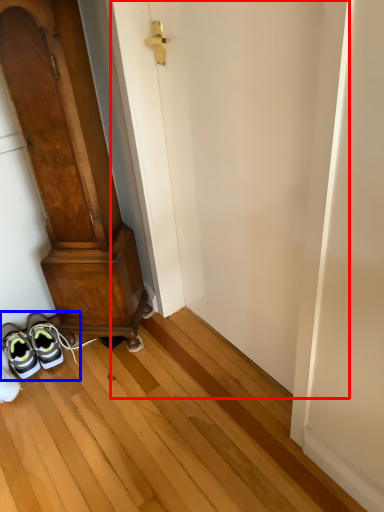
Question: Which of the following is the farthest to the observer, door (highlighted by a red box) or footwear (highlighted by a blue box)?

Choices:
 (A) door
 (B) footwear

Answer: (B)